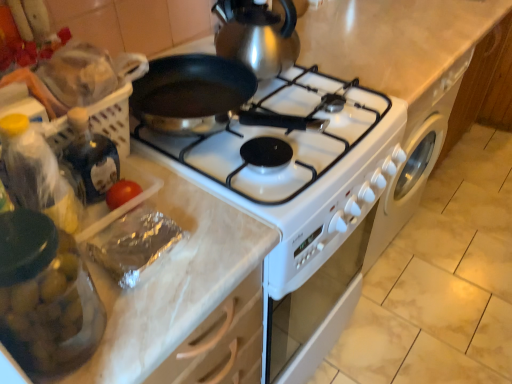
Question: From a real-world perspective, is translucent plastic bottle at left physically located above or below silver foil meat at lower left?

Choices:
 (A) above
 (B) below

Answer: (A)

Question: In terms of height, does translucent plastic bottle at left look taller or shorter compared to silver foil meat at lower left?

Choices:
 (A) short
 (B) tall

Answer: (B)

Question: Which is farther from the translucent plastic bottle at left?

Choices:
 (A) silver foil meat at lower left
 (B) transparent glass jar at left
 (C) shiny metallic gas stove at center

Answer: (C)

Question: Which of these objects is positioned farthest from the shiny metallic gas stove at center?

Choices:
 (A) translucent plastic bottle at left
 (B) silver foil meat at lower left
 (C) transparent glass jar at left

Answer: (C)